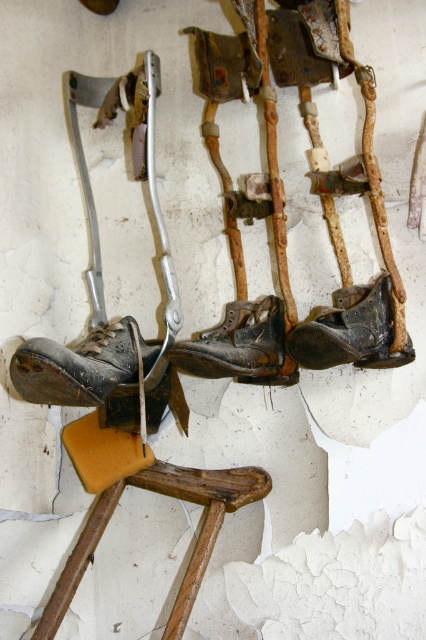
Question: Does wooden at center appear on the right side of leather boot at center?

Choices:
 (A) no
 (B) yes

Answer: (A)

Question: Does wooden at center appear under shiny black leather shoe at center?

Choices:
 (A) no
 (B) yes

Answer: (B)

Question: Which is farther from the leather boot at center?

Choices:
 (A) dark brown leather shoe at center
 (B) wooden at center
 (C) shiny black leather shoe at center

Answer: (B)

Question: Can you confirm if wooden at center is wider than shiny black leather shoe at center?

Choices:
 (A) no
 (B) yes

Answer: (B)

Question: Which object appears farthest from the camera in this image?

Choices:
 (A) dark brown leather shoe at center
 (B) shiny black leather shoe at center
 (C) wooden at center
 (D) leather boot at center

Answer: (A)

Question: Which of the following is the closest to the observer?

Choices:
 (A) (276, 336)
 (B) (256, 470)
 (C) (354, 324)

Answer: (C)